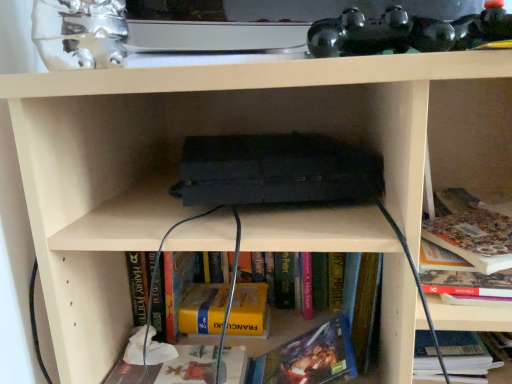
Question: In which direction should I rotate to look at matte paper book at lower center, which ranks as the first book in left-to-right order?

Choices:
 (A) right
 (B) left

Answer: (B)

Question: Could you tell me if hardcover book at lower right, which is counted as the fourth book, starting from the left, is turned towards hardcover book at lower center, positioned as the 2th book in right-to-left order?

Choices:
 (A) no
 (B) yes

Answer: (A)

Question: Is hardcover book at lower center, positioned as the 2th book in right-to-left order, located within hardcover book at lower right, which is counted as the first book, starting from the right?

Choices:
 (A) no
 (B) yes

Answer: (A)

Question: From the image's perspective, is hardcover book at lower right, which is counted as the first book, starting from the right, beneath hardcover book at lower center, positioned as the 2th book in right-to-left order?

Choices:
 (A) yes
 (B) no

Answer: (B)

Question: Is hardcover book at lower right, which is counted as the fourth book, starting from the left, far away from hardcover book at lower center, positioned as the 2th book in right-to-left order?

Choices:
 (A) no
 (B) yes

Answer: (A)

Question: Can you confirm if hardcover book at lower right, which is counted as the fourth book, starting from the left, is shorter than hardcover book at lower center, the 3th book positioned from the left?

Choices:
 (A) no
 (B) yes

Answer: (B)

Question: Can you confirm if hardcover book at lower right, which is counted as the fourth book, starting from the left, is smaller than hardcover book at lower center, positioned as the 2th book in right-to-left order?

Choices:
 (A) yes
 (B) no

Answer: (B)

Question: Is yellow matte book at center, which is the 2th book in left-to-right order, surrounded by matte paper book at lower center, which ranks as the first book in left-to-right order?

Choices:
 (A) no
 (B) yes

Answer: (A)

Question: From a real-world perspective, is matte paper book at lower center, which is counted as the 4th book, starting from the right, beneath yellow matte book at center, which is the 2th book in left-to-right order?

Choices:
 (A) no
 (B) yes

Answer: (B)

Question: Is the depth of matte paper book at lower center, which is counted as the 4th book, starting from the right, greater than that of yellow matte book at center, the third book when ordered from right to left?

Choices:
 (A) yes
 (B) no

Answer: (B)

Question: Is matte paper book at lower center, which ranks as the first book in left-to-right order, facing towards yellow matte book at center, the third book when ordered from right to left?

Choices:
 (A) no
 (B) yes

Answer: (A)

Question: From the image's perspective, is matte paper book at lower center, which ranks as the first book in left-to-right order, on top of yellow matte book at center, the third book when ordered from right to left?

Choices:
 (A) no
 (B) yes

Answer: (A)

Question: Is matte paper book at lower center, which ranks as the first book in left-to-right order, wider than yellow matte book at center, which is the 2th book in left-to-right order?

Choices:
 (A) yes
 (B) no

Answer: (A)

Question: From the image's perspective, is hardcover book at lower right, which is counted as the fourth book, starting from the left, over matte paper book at lower center, which is counted as the 4th book, starting from the right?

Choices:
 (A) yes
 (B) no

Answer: (A)